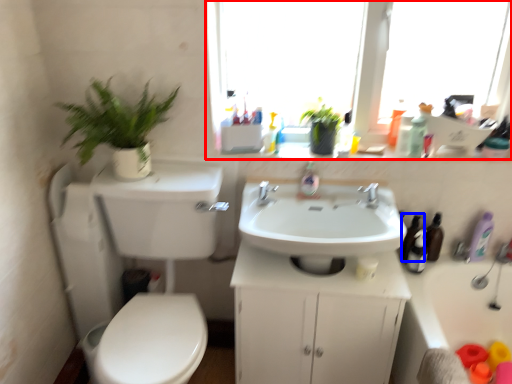
Question: Which object appears closest to the camera in this image, window (highlighted by a red box) or toiletry (highlighted by a blue box)?

Choices:
 (A) window
 (B) toiletry

Answer: (A)